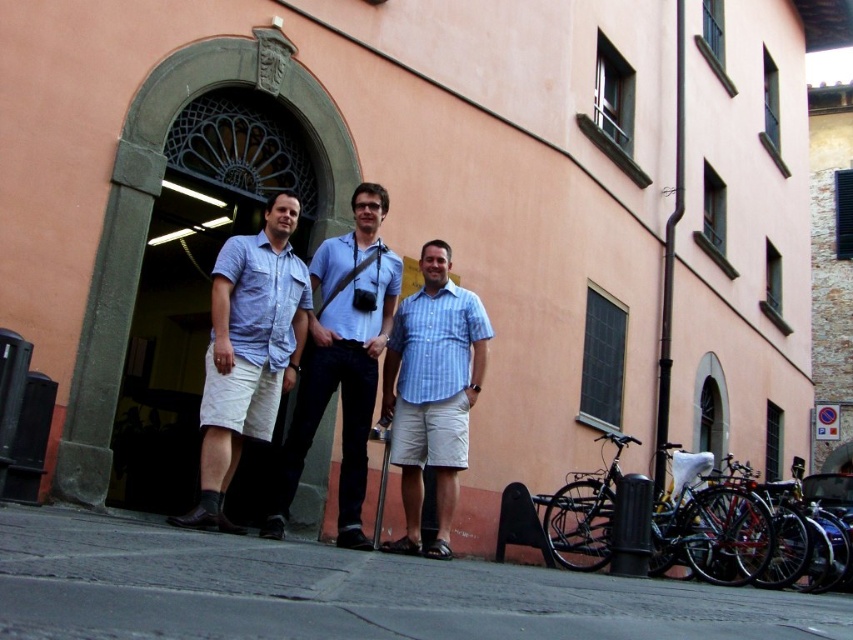
You are a photographer trying to capture a group photo of the three individuals standing in front of the building. You notice two people wearing shirts at the center. Which shirt, the light blue shirt at center or the blue striped shirt at center, would appear wider in the photo?

The light blue shirt at center might be wider than blue striped shirt at center according to the description.

Consider the image. You are standing in front of the building with the arched doorway. There is a person wearing a blue denim shirt at center. Where exactly is this person located in relation to the doorway?

The blue denim shirt at center is located at point 0.550 on the x axis and 0.292 on the y axis relative to the doorway.